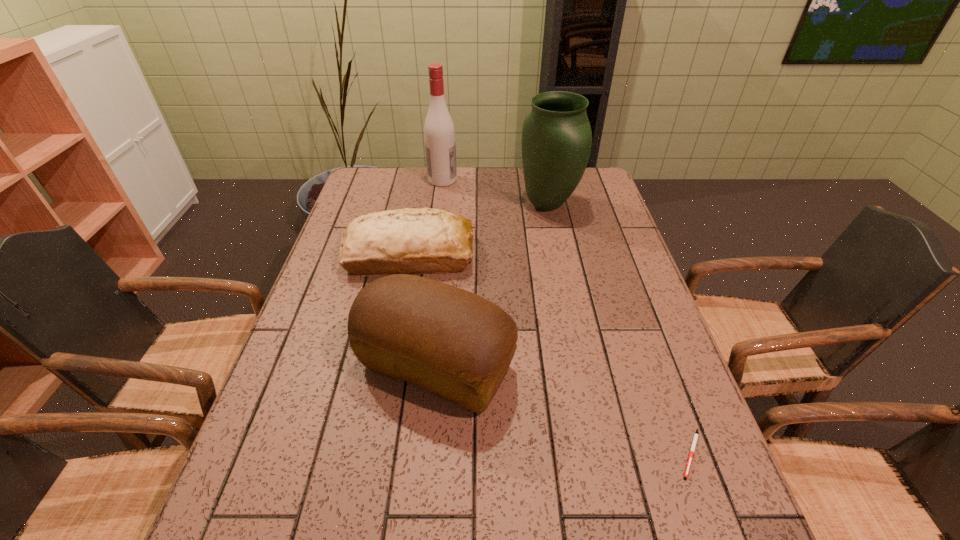
Locate an element on the screen. This screenshot has width=960, height=540. vacant position located 0.060m on the right of the third tallest object is located at coordinates (541, 367).

Where is `vacant space located 0.380m on the front of the second shortest object`? vacant space located 0.380m on the front of the second shortest object is located at coordinates (384, 398).

The image size is (960, 540). I want to click on free space located 0.080m on the clicker of the rightmost object, so click(x=718, y=528).

In order to click on alcohol present at the far edge in this screenshot , I will do `click(439, 132)`.

This screenshot has width=960, height=540. I want to click on vase that is at the far edge, so click(556, 142).

The height and width of the screenshot is (540, 960). Find the location of `object positioned at the left edge`. object positioned at the left edge is located at coordinates (405, 241).

Find the location of a particular element. The height and width of the screenshot is (540, 960). vase that is at the right edge is located at coordinates (556, 142).

I want to click on pen that is positioned at the right edge, so click(695, 438).

You are a GUI agent. You are given a task and a screenshot of the screen. Output one action in this format:
    pyautogui.click(x=<x>, y=<y>)
    Task: Click on the object that is at the far right corner
    
    Given the screenshot: What is the action you would take?
    pyautogui.click(x=556, y=142)

Identify the location of free region at the far edge of the desktop. This screenshot has height=540, width=960. (492, 175).